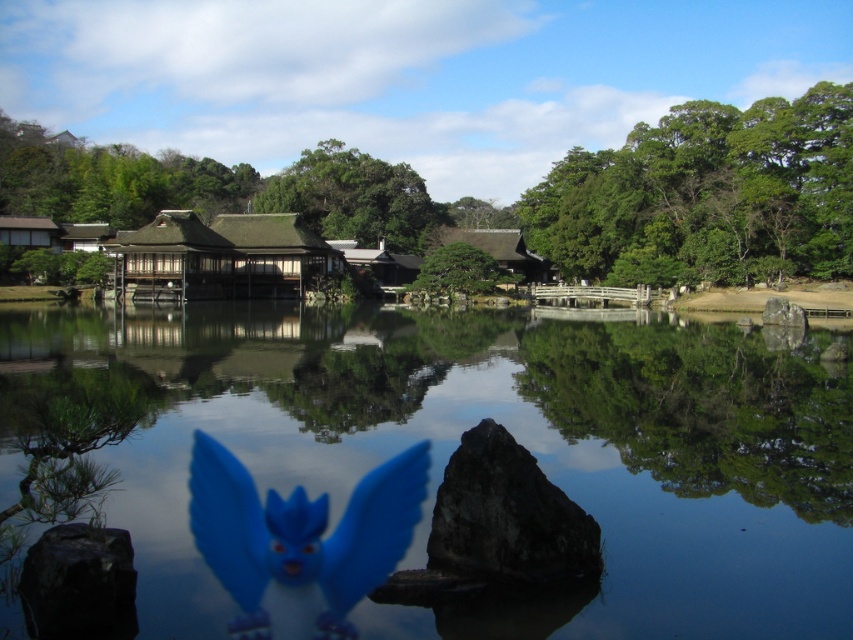
Looking at this image, which of these two, green leafy tree at upper right or blue plastic toy at center, stands shorter?

blue plastic toy at center is shorter.

Does green leafy tree at upper right appear on the left side of blue plastic toy at center?

No, green leafy tree at upper right is not to the left of blue plastic toy at center.

The height and width of the screenshot is (640, 853). I want to click on green leafy tree at upper right, so click(x=706, y=195).

Describe the element at coordinates (706, 195) in the screenshot. The image size is (853, 640). I see `green leafy tree at upper right` at that location.

How much distance is there between green leafy tree at upper right and gray rough rock at right?

They are 33.75 meters apart.

Does point (712, 262) come behind point (779, 314)?

Yes, point (712, 262) is behind point (779, 314).

This screenshot has width=853, height=640. Identify the location of green leafy tree at upper right. (706, 195).

Is the position of blue plastic toy at center less distant than that of dark gray rough rock at center?

No, blue plastic toy at center is further to the viewer.

Who is positioned more to the right, blue plastic toy at center or dark gray rough rock at center?

Positioned to the right is dark gray rough rock at center.

Which is behind, point (202, 477) or point (471, 502)?

Point (202, 477)

Locate an element on the screen. The height and width of the screenshot is (640, 853). blue plastic toy at center is located at coordinates (300, 540).